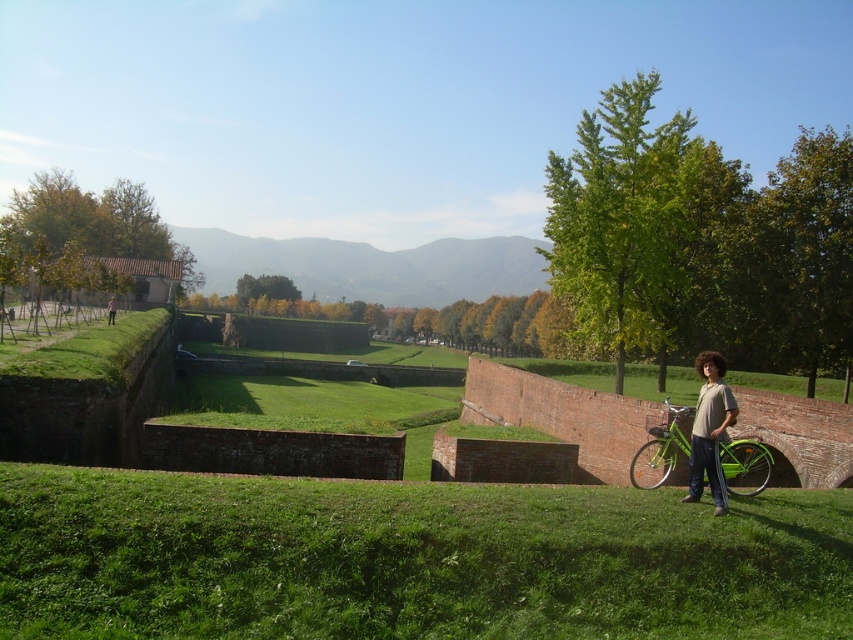
You are a photographer standing at the point labeled point (247, 589). You want to take a photo of the point labeled point (430, 268) without any obstructions. Is there anything between you and the target point that might block your view?

Point (247, 589) is in front of point (430, 268), so there is no obstruction between you and the target point. You can take the photo without any issues.

You are standing in the scene and want to walk to the green grassy hillside at center. Which direction should you move relative to the green grassy at lower center?

To reach the green grassy hillside at center, you should move away from the green grassy at lower center since the green grassy at lower center is closer to the viewer than the green grassy hillside at center.

You are a photographer trying to capture a landscape photo that includes both the green grassy hillside at center and the light brown cotton shirt at lower right. Since the shirt is smaller, where should you position the camera to ensure both objects are clearly visible in the frame?

To ensure both the green grassy hillside at center and the light brown cotton shirt at lower right are clearly visible, position the camera closer to the light brown cotton shirt at lower right. This will make the shirt appear larger in the frame while still capturing the green grassy hillside at center in the background, as it has a larger size and will remain visible despite the distance.